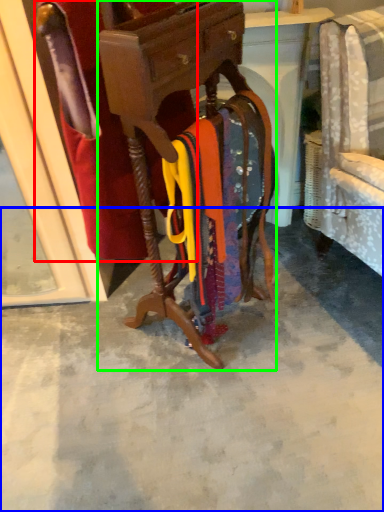
Question: Which object is positioned farthest from robe (highlighted by a red box)? Select from concrete (highlighted by a blue box) and furniture (highlighted by a green box).

Choices:
 (A) concrete
 (B) furniture

Answer: (A)